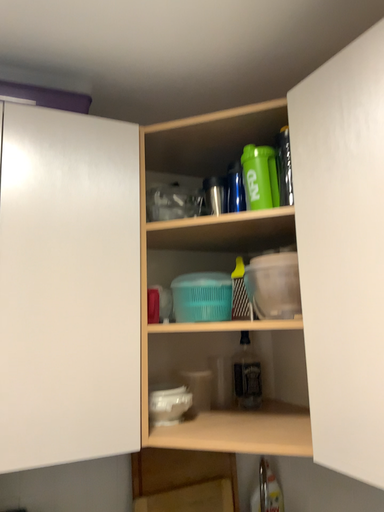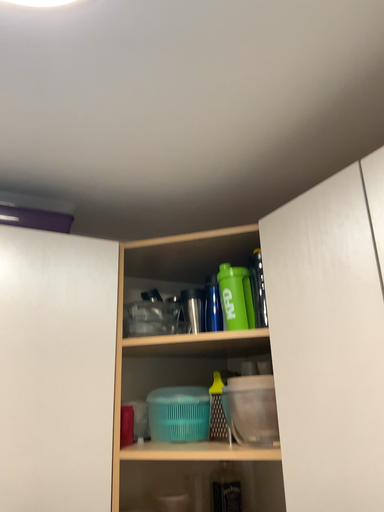
Question: Which way did the camera rotate in the video?

Choices:
 (A) rotated downward
 (B) rotated upward

Answer: (B)